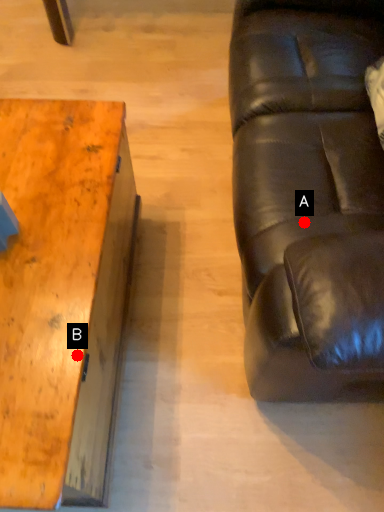
Question: Two points are circled on the image, labeled by A and B beside each circle. Among these points, which one is farthest from the camera?

Choices:
 (A) A is further
 (B) B is further

Answer: (A)